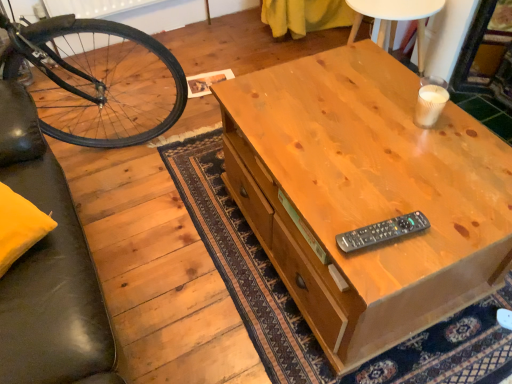
The width and height of the screenshot is (512, 384). In order to click on vacant space to the right of white paper cup at upper right in this screenshot , I will do `click(462, 125)`.